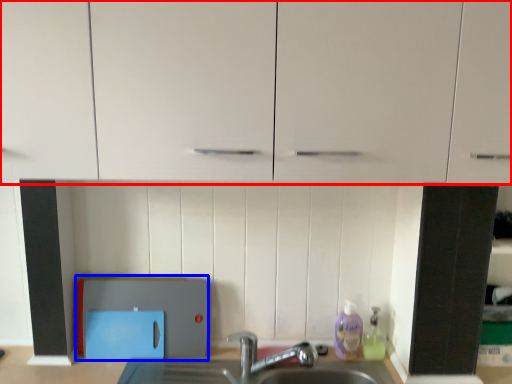
Question: Which object is further to the camera taking this photo, cabinetry (highlighted by a red box) or appliance (highlighted by a blue box)?

Choices:
 (A) cabinetry
 (B) appliance

Answer: (B)